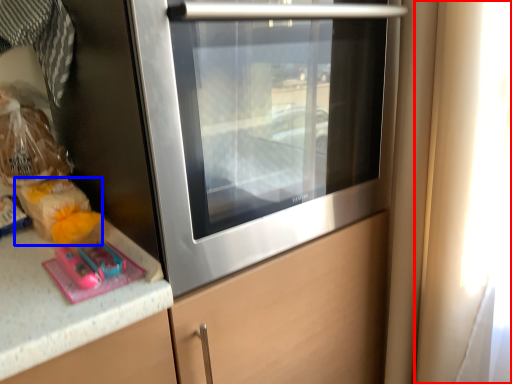
Question: Which point is further to the camera, window (highlighted by a red box) or food (highlighted by a blue box)?

Choices:
 (A) window
 (B) food

Answer: (B)